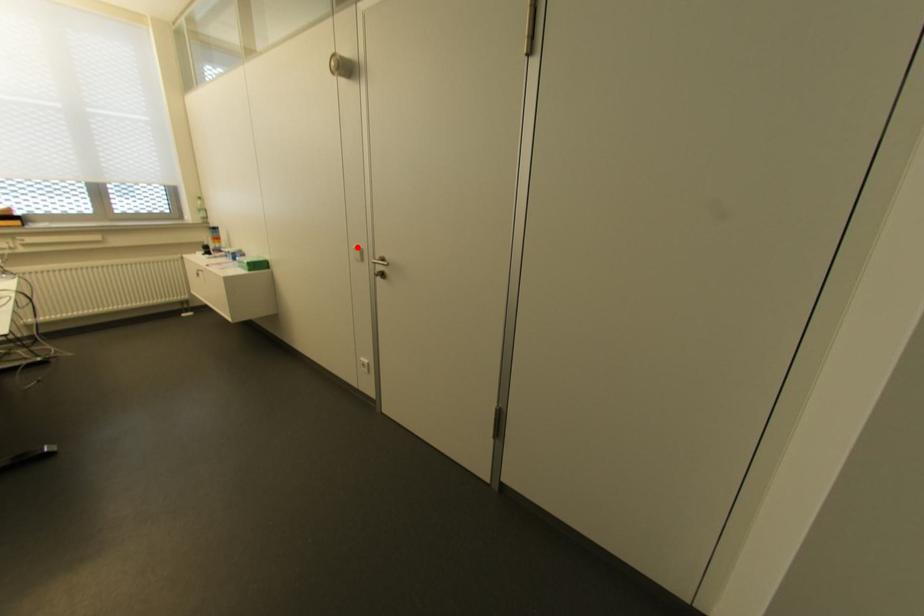
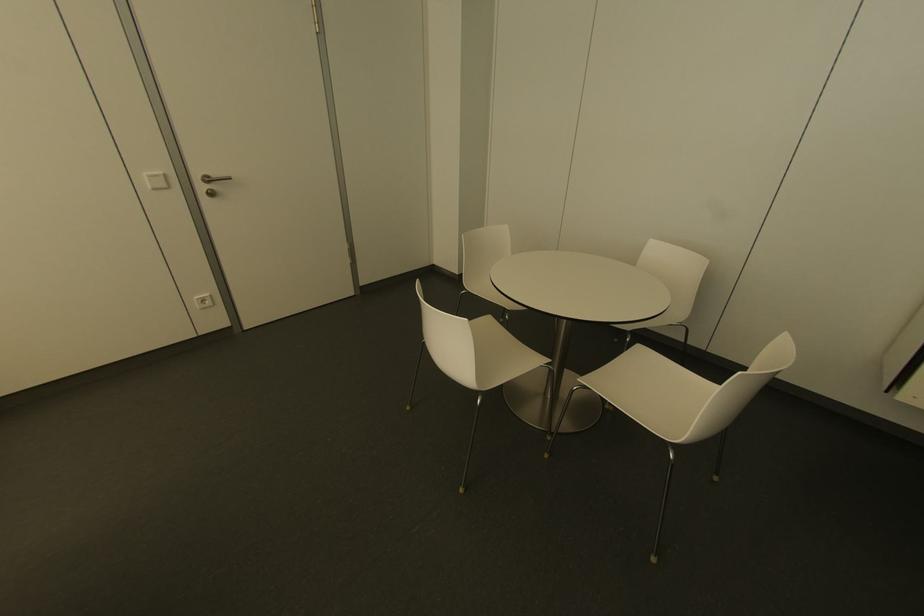
Find the pixel in the second image that matches the highlighted location in the first image.

(159, 172)